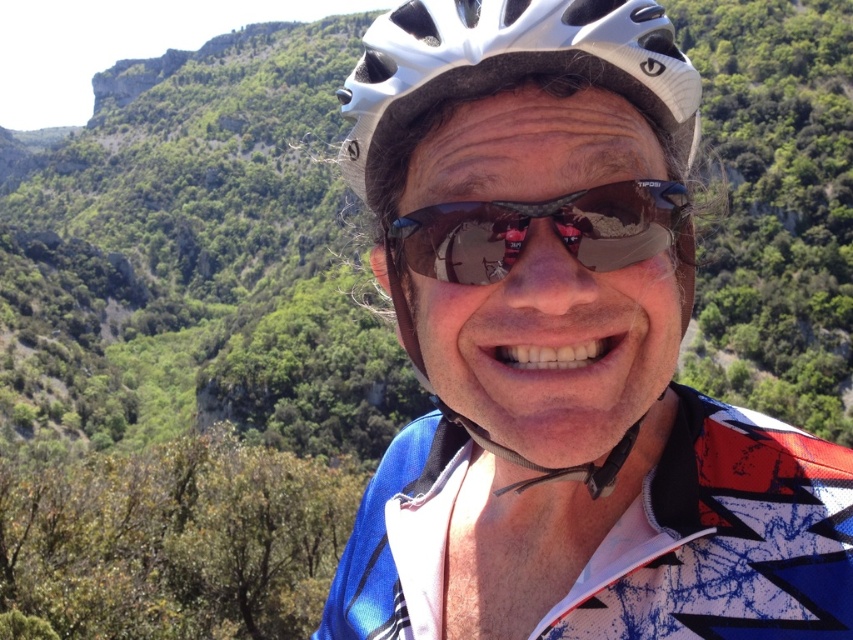
Question: Based on their relative distances, which object is nearer to the white matte bicycle helmet at center?

Choices:
 (A) shiny reflective sunglasses at center
 (B) white matte helmet at center

Answer: (A)

Question: Can you confirm if white matte helmet at center is bigger than white matte bicycle helmet at center?

Choices:
 (A) yes
 (B) no

Answer: (A)

Question: Can you confirm if white matte helmet at center is wider than shiny reflective sunglasses at center?

Choices:
 (A) yes
 (B) no

Answer: (A)

Question: Among these objects, which one is farthest from the camera?

Choices:
 (A) white matte helmet at center
 (B) white matte bicycle helmet at center

Answer: (B)

Question: Can you confirm if white matte bicycle helmet at center is wider than shiny reflective sunglasses at center?

Choices:
 (A) no
 (B) yes

Answer: (B)

Question: Which object is positioned closest to the white matte helmet at center?

Choices:
 (A) shiny reflective sunglasses at center
 (B) white matte bicycle helmet at center

Answer: (B)